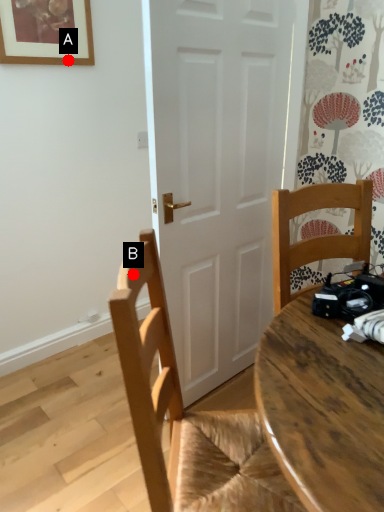
Question: Two points are circled on the image, labeled by A and B beside each circle. Which point is closer to the camera taking this photo?

Choices:
 (A) A is closer
 (B) B is closer

Answer: (B)